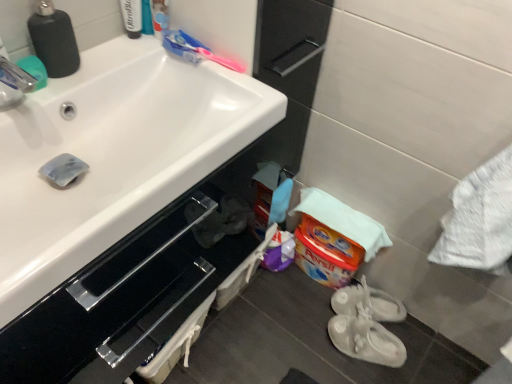
Question: Is pink plastic toothbrush at upper center to the left or to the right of translucent plastic toothbrush at upper center, positioned as the second toiletry in left-to-right order, in the image?

Choices:
 (A) right
 (B) left

Answer: (A)

Question: Considering the positions of point (231, 69) and point (154, 21), is point (231, 69) closer or farther from the camera than point (154, 21)?

Choices:
 (A) closer
 (B) farther

Answer: (A)

Question: Which object is the closest to the white rubber shoes at lower right, positioned as the 1th footwear in back-to-front order?

Choices:
 (A) translucent plastic toothbrush at upper center, arranged as the first toiletry when viewed from the right
 (B) white glossy tube at upper left, the first toiletry positioned from the left
 (C) pink plastic toothbrush at upper center
 (D) black matte soap dispenser at upper left
 (E) white glossy sink at upper left

Answer: (C)

Question: Estimate the real-world distances between objects in this image. Which object is farther from the pink plastic toothbrush at upper center?

Choices:
 (A) white glossy tube at upper left, which ranks as the 2th toiletry in right-to-left order
 (B) translucent plastic toothbrush at upper center, positioned as the second toiletry in left-to-right order
 (C) white rubber shoes at lower right, which ranks as the 1th footwear in front-to-back order
 (D) black matte soap dispenser at upper left
 (E) white rubber shoes at lower right, the 2th footwear positioned from the front

Answer: (C)